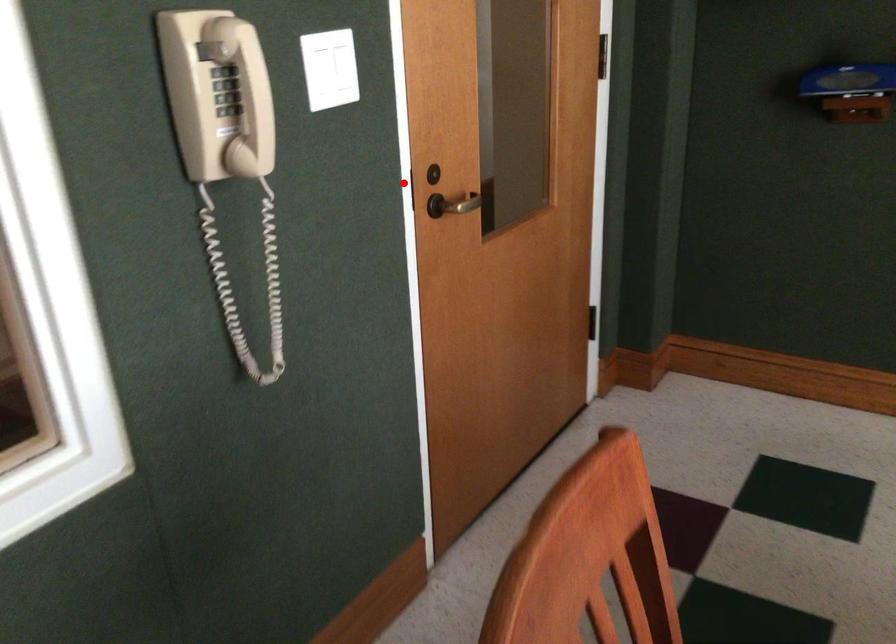
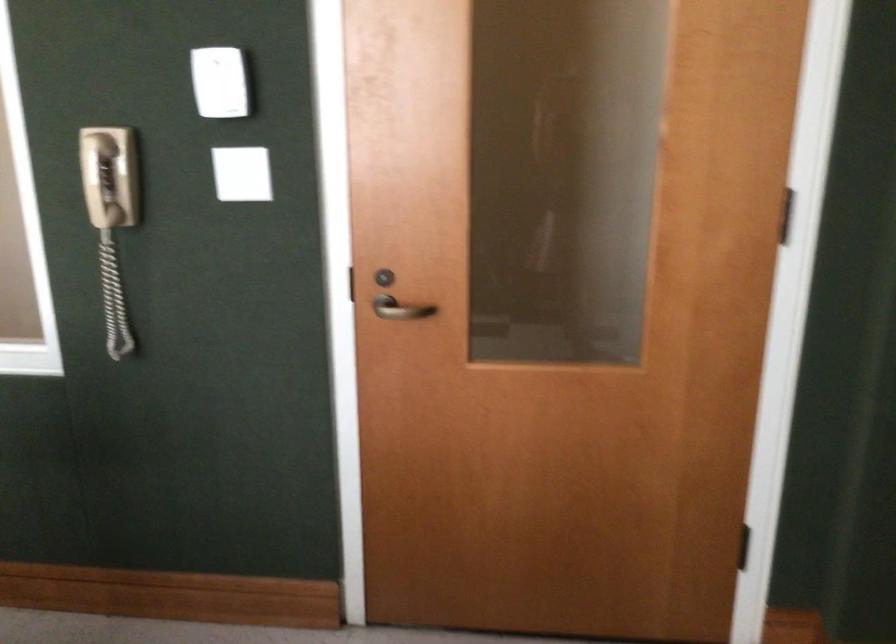
Question: I am providing you with two images of the same scene from different viewpoints. In image1, a red point is highlighted. Considering the same 3D point in image2, which of the following is correct?

Choices:
 (A) It is closer
 (B) It is farther

Answer: (B)